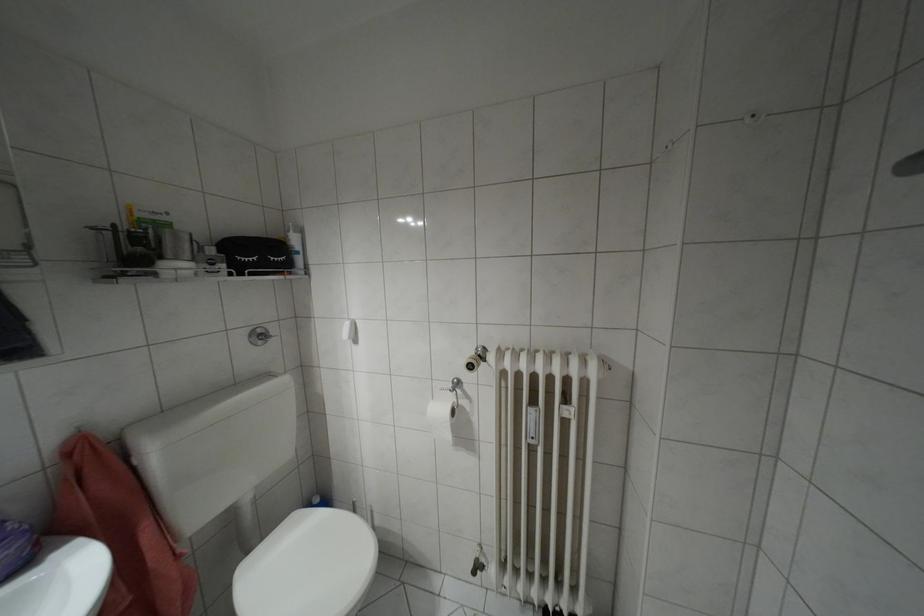
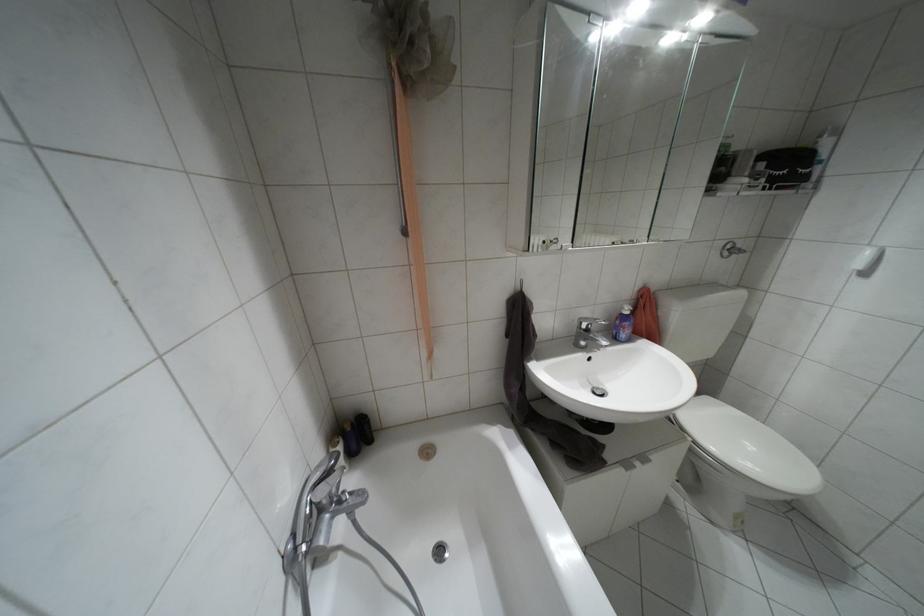
Based on the continuous images, in which direction is the camera rotating?

The rotation direction of the camera is left-down.